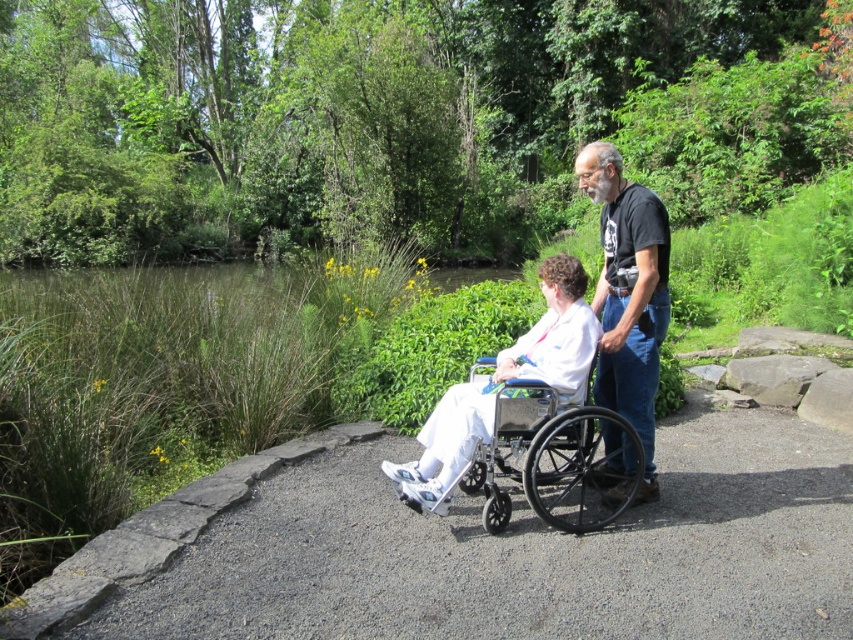
Question: Does metallic silver wheelchair at center appear over black t-shirt at upper center?

Choices:
 (A) no
 (B) yes

Answer: (B)

Question: Is metallic silver wheelchair at center below black t-shirt at upper center?

Choices:
 (A) yes
 (B) no

Answer: (B)

Question: Does metallic silver wheelchair at center appear on the left side of black t-shirt at upper center?

Choices:
 (A) no
 (B) yes

Answer: (B)

Question: Among these points, which one is nearest to the camera?

Choices:
 (A) (595, 304)
 (B) (595, 477)

Answer: (B)

Question: Which object is farther from the camera taking this photo?

Choices:
 (A) black t-shirt at upper center
 (B) metallic silver wheelchair at center

Answer: (A)